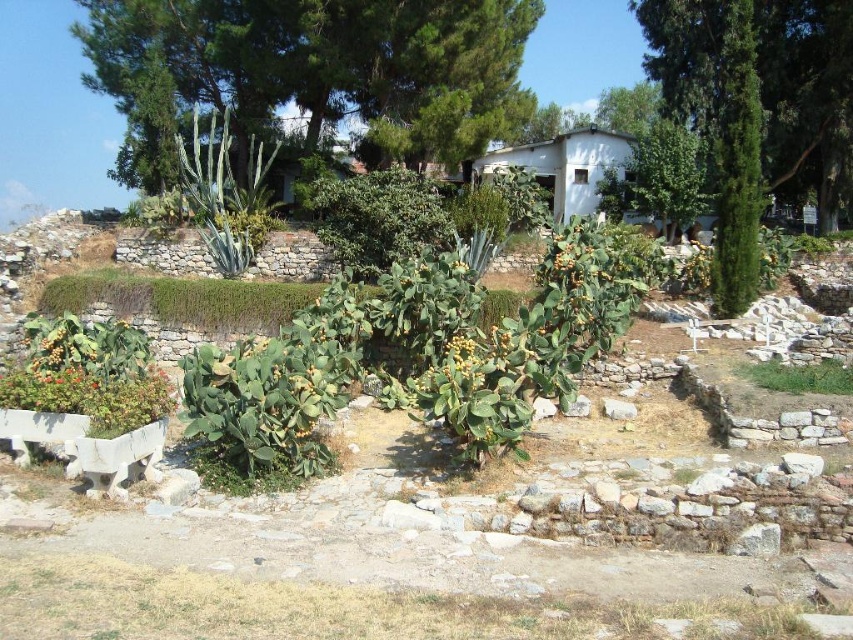
You are standing in the rustic outdoor scene and want to take a photo of the green leafy tree at upper center and the green leafy tree at upper right. Which tree is closer to the camera?

The green leafy tree at upper center is positioned over the green leafy tree at upper right, so it is closer to the camera.

You are standing in the rustic outdoor scene and want to take a photo of both the green leafy tree at upper center and the green leafy tree at upper right. Which tree is positioned to the left of the other?

The green leafy tree at upper center is positioned to the left of the green leafy tree at upper right.

Consider the image. You are standing in the rustic outdoor scene and want to find shade. Which green leafy tree would provide more coverage? The green leafy tree at upper center or the green leafy tree at upper right?

The green leafy tree at upper right is taller than the green leafy tree at upper center, so it would provide more shade coverage.